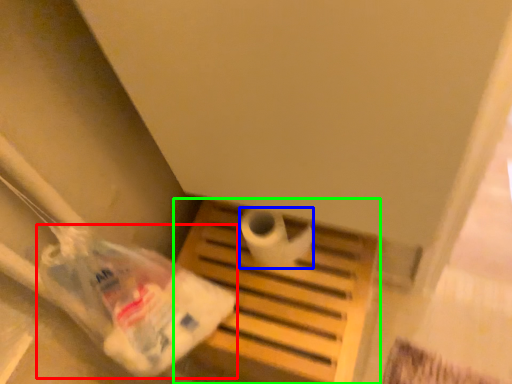
Question: Which object is the closest to the plastic bag (highlighted by a red box)? Choose among these: toilet paper (highlighted by a blue box) or furniture (highlighted by a green box).

Choices:
 (A) toilet paper
 (B) furniture

Answer: (B)